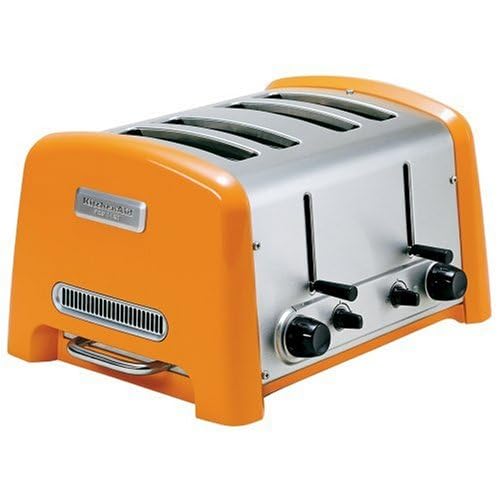
At what (x,y) coordinates should I click in order to perform the action: click on toaster. Please return your answer as a coordinate pair (x, y). Looking at the image, I should click on (343, 277).